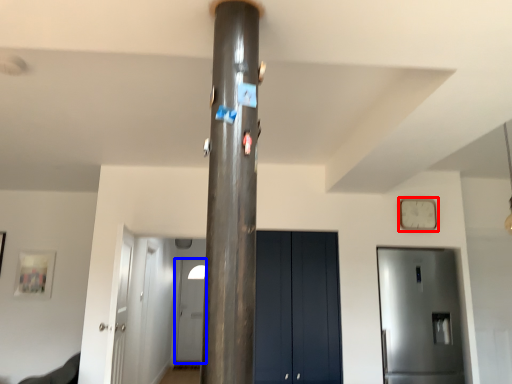
Question: Which of the following is the farthest to the observer, clock (highlighted by a red box) or door (highlighted by a blue box)?

Choices:
 (A) clock
 (B) door

Answer: (B)